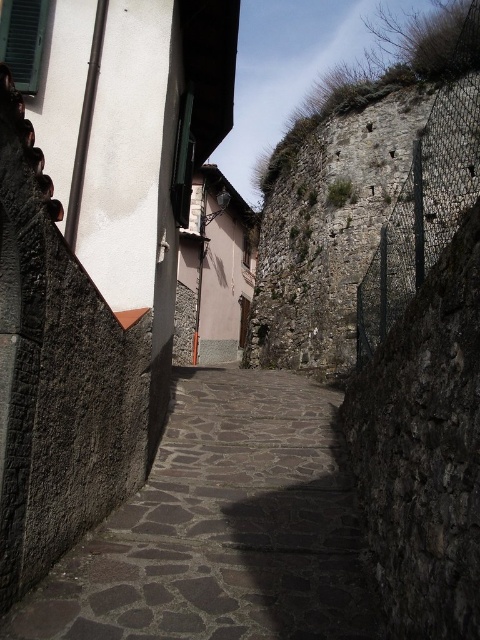
Question: Where is stone paved path at center located in relation to rough stone wall at upper right in the image?

Choices:
 (A) below
 (B) above

Answer: (A)

Question: Is stone paved path at center to the right of rough stone wall at upper right from the viewer's perspective?

Choices:
 (A) no
 (B) yes

Answer: (A)

Question: Which object appears farthest from the camera in this image?

Choices:
 (A) stone paved path at center
 (B) rough stone wall at upper right

Answer: (B)

Question: Where is stone paved path at center located in relation to rough stone wall at upper right in the image?

Choices:
 (A) right
 (B) left

Answer: (B)

Question: Which of the following is the farthest from the observer?

Choices:
 (A) rough stone wall at upper right
 (B) stone paved path at center

Answer: (A)